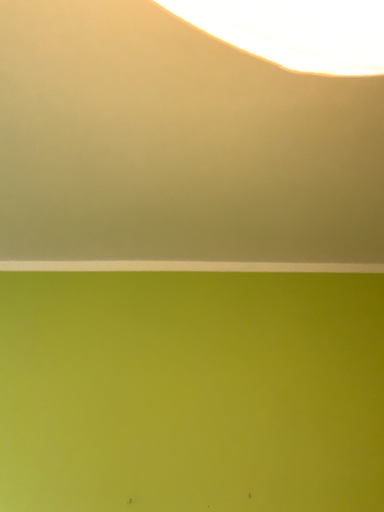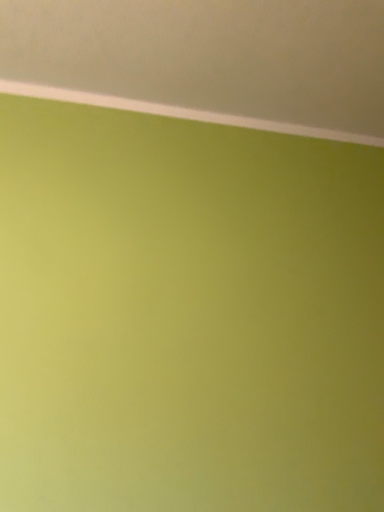
Question: Which way did the camera rotate in the video?

Choices:
 (A) rotated downward
 (B) rotated upward

Answer: (A)